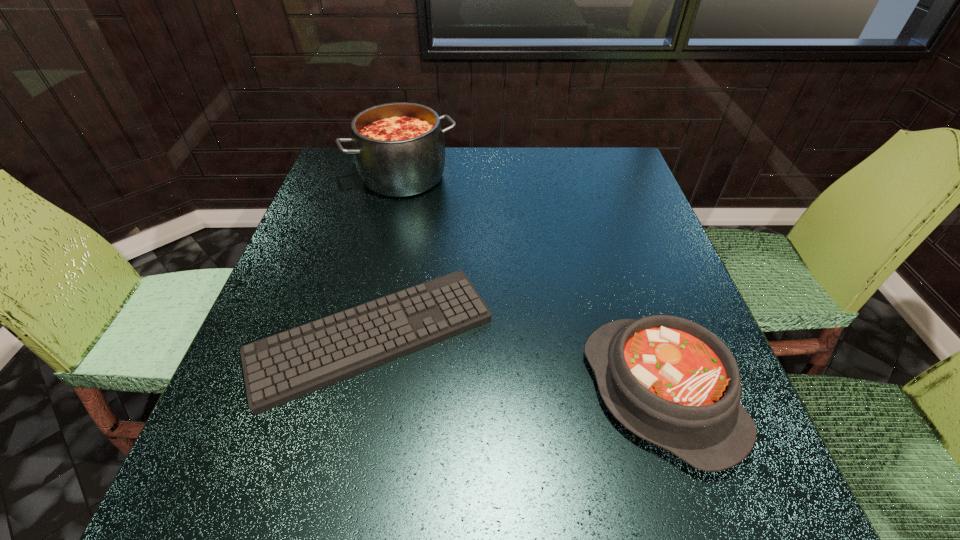
Find the location of a particular element. Image resolution: width=960 pixels, height=540 pixels. casserole that is at the left edge is located at coordinates (399, 150).

This screenshot has width=960, height=540. In order to click on computer keyboard located at the left edge in this screenshot , I will do `click(283, 367)`.

Where is `object that is at the right edge`? object that is at the right edge is located at coordinates (670, 381).

Where is `object that is at the far left corner`? The height and width of the screenshot is (540, 960). object that is at the far left corner is located at coordinates (399, 150).

Where is `object present at the near right corner`? This screenshot has height=540, width=960. object present at the near right corner is located at coordinates (670, 381).

The width and height of the screenshot is (960, 540). In order to click on free location at the far edge in this screenshot , I will do `click(557, 192)`.

In the image, there is a desktop. At what (x,y) coordinates should I click in order to perform the action: click on vacant space at the near edge. Please return your answer as a coordinate pair (x, y). This screenshot has width=960, height=540. Looking at the image, I should click on (531, 465).

In the image, there is a desktop. Where is `vacant space at the left edge`? vacant space at the left edge is located at coordinates (345, 237).

Locate an element on the screen. Image resolution: width=960 pixels, height=540 pixels. blank space at the near left corner of the desktop is located at coordinates (254, 483).

This screenshot has height=540, width=960. Find the location of `free space at the far right corner`. free space at the far right corner is located at coordinates (588, 156).